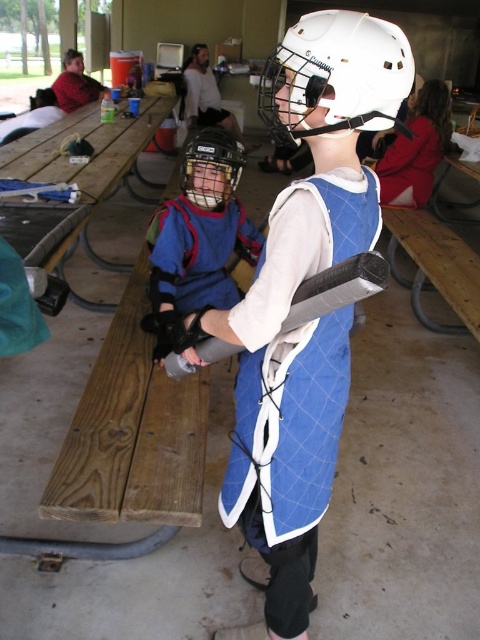
You are a safety inspector at the picnic shelter and need to ensure all helmets meet the minimum height requirement of 15 cm. The white matte helmet at center and the matte black helmet at center are both being inspected. According to the description, which helmet meets the requirement?

The white matte helmet at center is taller than the matte black helmet at center, so it meets the minimum height requirement of 15 cm.

You are standing in the picnic area and want to reach the point marked at coordinates (333, 465). If you take a step forward, will you get closer to that point?

Yes, because the point is 1.36 meters away from the viewer, stepping forward would reduce the distance to it.